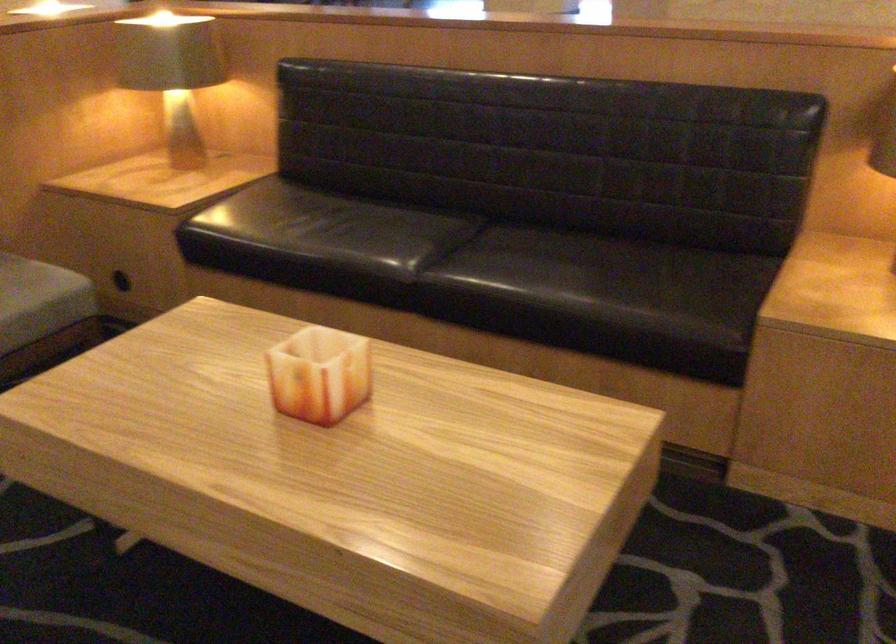
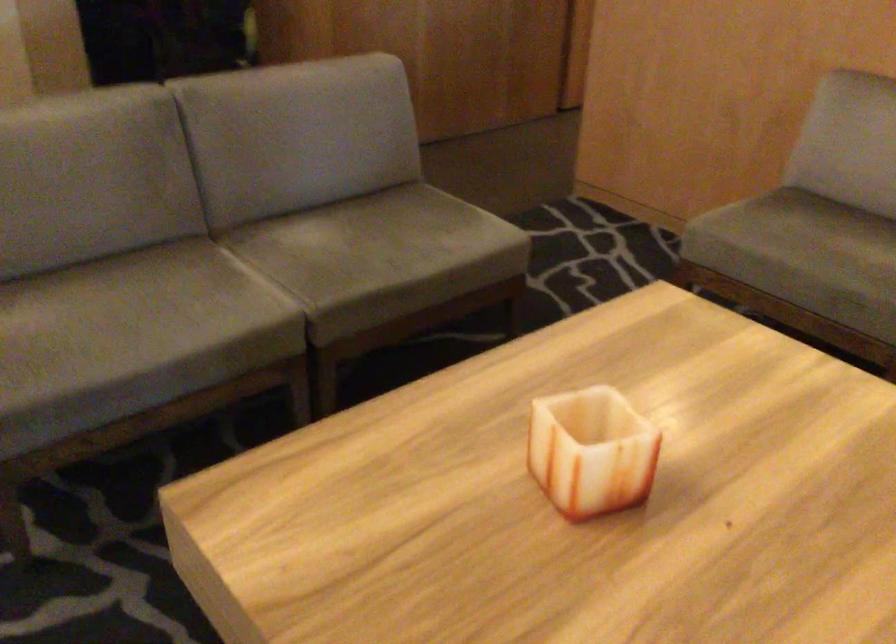
Based on the continuous images, in which direction is the camera rotating?

The camera's rotation is toward left-down.